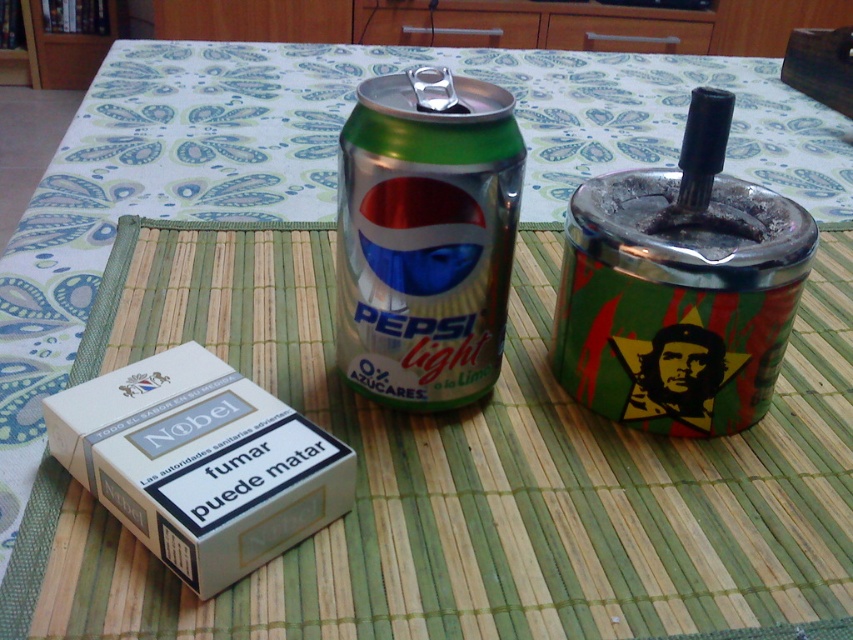
Question: Estimate the real-world distances between objects in this image. Which object is closer to the metallic ashtray at right?

Choices:
 (A) white matte cigarette box at lower left
 (B) metallic silver can at center

Answer: (B)

Question: Which object appears closest to the camera in this image?

Choices:
 (A) white matte cigarette box at lower left
 (B) metallic ashtray at right
 (C) metallic silver can at center

Answer: (A)

Question: Considering the real-world distances, which object is closest to the white matte cigarette box at lower left?

Choices:
 (A) metallic silver can at center
 (B) metallic ashtray at right

Answer: (A)

Question: Can you confirm if metallic ashtray at right is positioned to the right of white matte cigarette box at lower left?

Choices:
 (A) no
 (B) yes

Answer: (B)

Question: Does metallic ashtray at right have a smaller size compared to white matte cigarette box at lower left?

Choices:
 (A) yes
 (B) no

Answer: (B)

Question: Considering the relative positions of metallic silver can at center and white matte cigarette box at lower left in the image provided, where is metallic silver can at center located with respect to white matte cigarette box at lower left?

Choices:
 (A) left
 (B) right

Answer: (B)